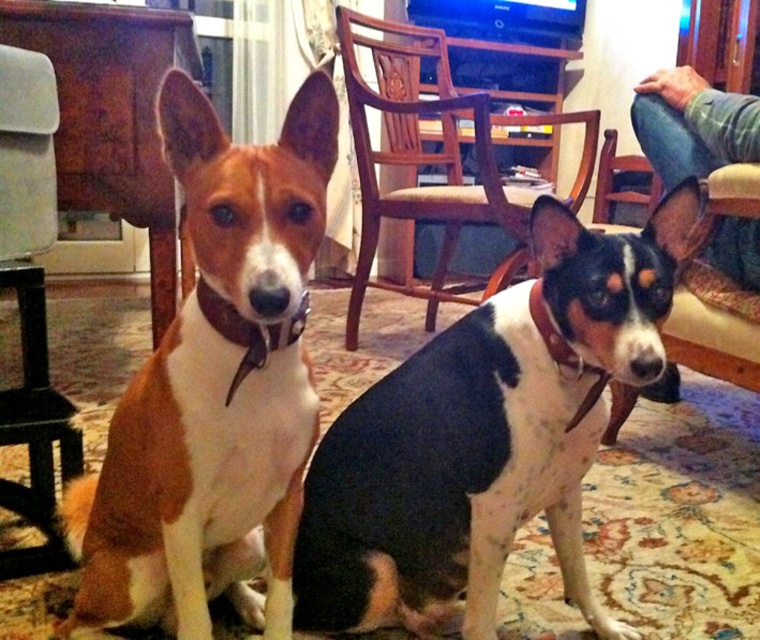
From the picture: You are standing in the living room and want to place a 36 inch wide decorative shelf on the wall directly behind the point at coordinates point (469,376). Will the shelf fit without overlapping the point?

The distance between the viewer and point (469,376) is 38.43 inches. Since the shelf is 36 inches wide, it will fit as it is narrower than the available space.

You are a photographer trying to capture a closeup of the black and white fur at center and the brown leather collar at center. Which one should you zoom in on to ensure both are in frame without moving the camera?

The black and white fur at center is wider than the brown leather collar at center, so you should zoom in on the black and white fur at center to ensure both fit in the frame.